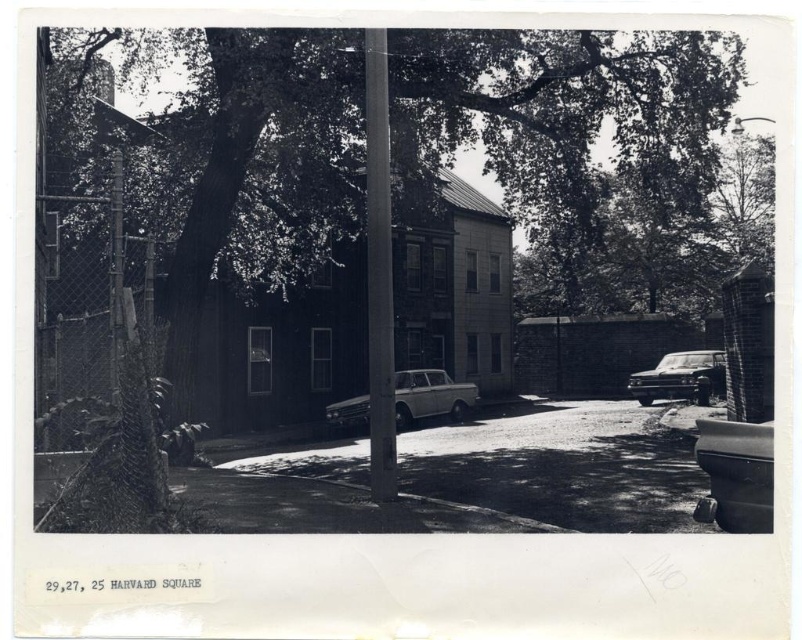
You are a pedestrian standing at the edge of the road and see the metallic pole at center and the metallic silver station wagon at center. Which object is closer to you?

The metallic silver station wagon at center is closer to you because the metallic pole at center is positioned over it, indicating it is behind the wagon.